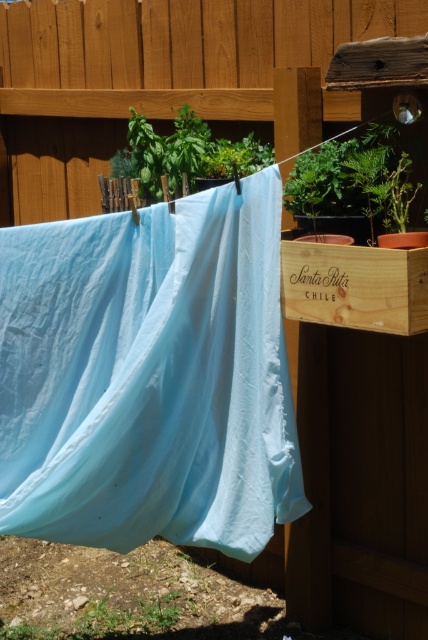
You are organizing a backyard party and want to ensure there is enough space for decorations. You have a large banner that needs to be hung. Given the light blue fabric at center and the green leafy plant at upper right, which object would be more suitable to hang the banner on, considering their sizes?

The light blue fabric at center is larger in size than the green leafy plant at upper right, so the banner would be more suitable to hang on the light blue fabric at center as it provides a bigger surface area.

You are standing in the backyard looking at the wooden fence. You see a light blue fabric at center and a wooden at upper center. Which object is closer to the ground?

The light blue fabric at center is closer to the ground because it is located below the wooden at upper center.